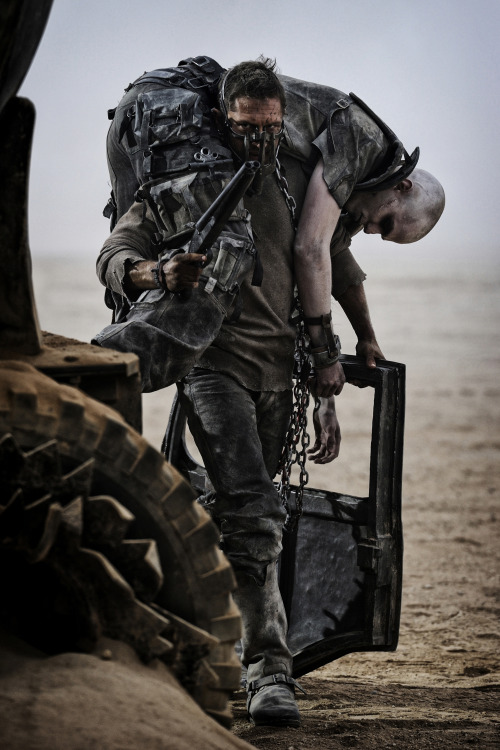
Locate an element on the screen. door is located at coordinates (324, 544).